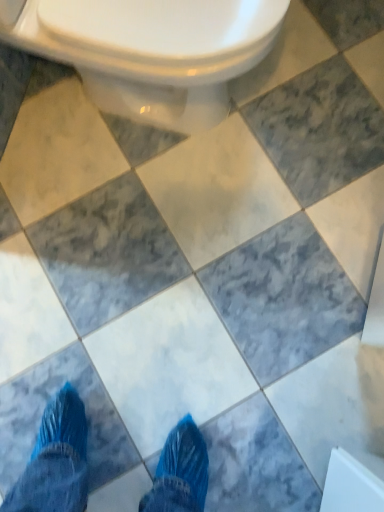
In order to click on vacant area to the right of white glossy toilet at upper center in this screenshot , I will do `click(322, 98)`.